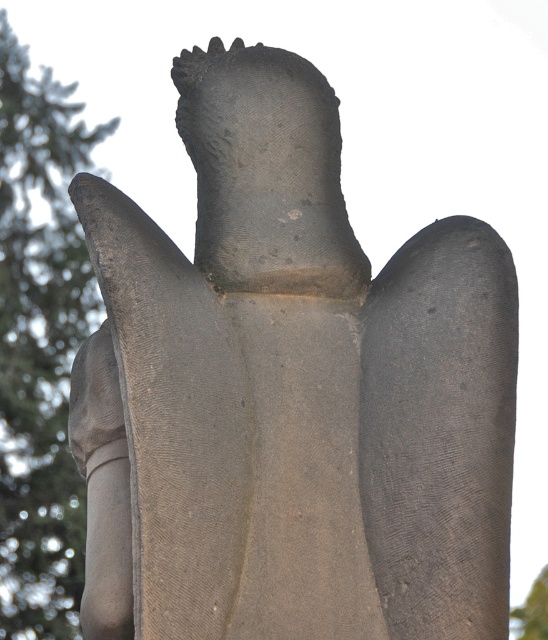
Question: Can you confirm if matte gray hand at left is wider than green leafy tree at upper left?

Choices:
 (A) yes
 (B) no

Answer: (A)

Question: Which of the following is the farthest from the observer?

Choices:
 (A) green textured tree at left
 (B) matte gray hand at left

Answer: (A)

Question: Is green textured tree at left below matte gray hand at left?

Choices:
 (A) yes
 (B) no

Answer: (B)

Question: Which point appears farthest from the camera in this image?

Choices:
 (A) (79, 369)
 (B) (47, 442)
 (C) (511, 627)

Answer: (C)

Question: Among these points, which one is farthest from the camera?

Choices:
 (A) (528, 618)
 (B) (75, 364)

Answer: (A)

Question: Is green textured tree at left positioned in front of matte gray hand at left?

Choices:
 (A) no
 (B) yes

Answer: (A)